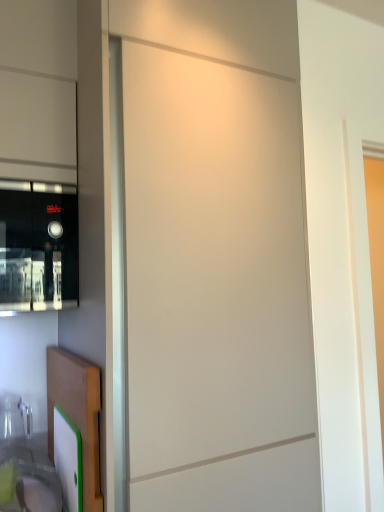
What do you see at coordinates (77, 413) in the screenshot?
I see `wooden cutting board at lower left` at bounding box center [77, 413].

I want to click on black glass microwave at left, so click(x=38, y=246).

Locate an element on the screen. The image size is (384, 512). matte white screen door at center is located at coordinates click(x=215, y=289).

Would you say black glass microwave at left is to the left or to the right of matte white screen door at center in the picture?

From the image, it's evident that black glass microwave at left is to the left of matte white screen door at center.

Can you confirm if black glass microwave at left is thinner than matte white screen door at center?

Correct, the width of black glass microwave at left is less than that of matte white screen door at center.

Consider the image. Which of these two, black glass microwave at left or matte white screen door at center, is bigger?

matte white screen door at center is bigger.

From a real-world perspective, who is located lower, black glass microwave at left or matte white screen door at center?

In real-world perspective, matte white screen door at center is lower.

Between matte white screen door at center and wooden cutting board at lower left, which one has smaller size?

wooden cutting board at lower left.

Is matte white screen door at center in front of wooden cutting board at lower left?

Yes, matte white screen door at center is in front of wooden cutting board at lower left.

Is there a large distance between matte white screen door at center and wooden cutting board at lower left?

Actually, matte white screen door at center and wooden cutting board at lower left are a little close together.

From a real-world perspective, is wooden cutting board at lower left beneath matte white screen door at center?

Yes, from a real-world perspective, wooden cutting board at lower left is beneath matte white screen door at center.

Which is in front, point (71, 401) or point (164, 277)?

The point (164, 277) is in front.

Is wooden cutting board at lower left positioned with its back to matte white screen door at center?

Yes, wooden cutting board at lower left is positioned with its back facing matte white screen door at center.

From the image's perspective, which object appears higher, black glass microwave at left or translucent plastic sink at lower left?

black glass microwave at left, from the image's perspective.

Are black glass microwave at left and translucent plastic sink at lower left making contact?

No, black glass microwave at left is not with translucent plastic sink at lower left.

Is black glass microwave at left taller than translucent plastic sink at lower left?

Indeed, black glass microwave at left has a greater height compared to translucent plastic sink at lower left.

Is point (51, 261) farther from viewer compared to point (27, 465)?

Yes.

Can you confirm if black glass microwave at left is positioned to the left of wooden cutting board at lower left?

Indeed, black glass microwave at left is positioned on the left side of wooden cutting board at lower left.

Is the surface of black glass microwave at left in direct contact with wooden cutting board at lower left?

No.

The width and height of the screenshot is (384, 512). What are the coordinates of `cabinetry located in front of the black glass microwave at left` in the screenshot? It's located at (77, 413).

In the scene shown: From the image's perspective, is translucent plastic sink at lower left located above matte white screen door at center?

No.

Is matte white screen door at center inside translucent plastic sink at lower left?

No, matte white screen door at center is not a part of translucent plastic sink at lower left.

Is translucent plastic sink at lower left positioned far away from matte white screen door at center?

translucent plastic sink at lower left is near matte white screen door at center, not far away.

Is translucent plastic sink at lower left facing towards matte white screen door at center?

No, translucent plastic sink at lower left is not oriented towards matte white screen door at center.

Which object is positioned more to the right, wooden cutting board at lower left or black glass microwave at left?

Positioned to the right is wooden cutting board at lower left.

Are wooden cutting board at lower left and black glass microwave at left far apart?

No, there isn't a large distance between wooden cutting board at lower left and black glass microwave at left.

From the image's perspective, which is above, wooden cutting board at lower left or black glass microwave at left?

black glass microwave at left appears higher in the image.

Which point is more forward, (84, 448) or (65, 243)?

Positioned in front is point (84, 448).

The width and height of the screenshot is (384, 512). I want to click on screen door located in front of the black glass microwave at left, so click(x=215, y=289).

Where is `screen door that appears above the wooden cutting board at lower left (from a real-world perspective)`? The image size is (384, 512). screen door that appears above the wooden cutting board at lower left (from a real-world perspective) is located at coordinates (215, 289).

From the image, which object appears to be nearer to translucent plastic sink at lower left, black glass microwave at left or matte white screen door at center?

black glass microwave at left is positioned closer to the anchor translucent plastic sink at lower left.

Considering their positions, is wooden cutting board at lower left positioned further to black glass microwave at left than matte white screen door at center?

matte white screen door at center lies further to black glass microwave at left than the other object.

Which object lies nearer to the anchor point black glass microwave at left, translucent plastic sink at lower left or wooden cutting board at lower left?

Among the two, wooden cutting board at lower left is located nearer to black glass microwave at left.

Considering their positions, is matte white screen door at center positioned further to translucent plastic sink at lower left than black glass microwave at left?

matte white screen door at center is further to translucent plastic sink at lower left.

Considering their positions, is black glass microwave at left positioned further to wooden cutting board at lower left than translucent plastic sink at lower left?

black glass microwave at left is positioned further to the anchor wooden cutting board at lower left.

Considering their positions, is translucent plastic sink at lower left positioned further to matte white screen door at center than black glass microwave at left?

translucent plastic sink at lower left.

From the image, which object appears to be farther from translucent plastic sink at lower left, wooden cutting board at lower left or black glass microwave at left?

black glass microwave at left lies further to translucent plastic sink at lower left than the other object.

From the image, which object appears to be nearer to translucent plastic sink at lower left, matte white screen door at center or wooden cutting board at lower left?

Among the two, wooden cutting board at lower left is located nearer to translucent plastic sink at lower left.

Where is `cabinetry that lies between matte white screen door at center and translucent plastic sink at lower left from top to bottom`? The height and width of the screenshot is (512, 384). cabinetry that lies between matte white screen door at center and translucent plastic sink at lower left from top to bottom is located at coordinates (77, 413).

Locate an element on the screen. The image size is (384, 512). cabinetry between black glass microwave at left and translucent plastic sink at lower left in the up-down direction is located at coordinates (77, 413).

Identify the location of screen door between black glass microwave at left and translucent plastic sink at lower left vertically. This screenshot has height=512, width=384. (215, 289).

Identify the location of screen door that lies between black glass microwave at left and wooden cutting board at lower left from top to bottom. Image resolution: width=384 pixels, height=512 pixels. [x=215, y=289].